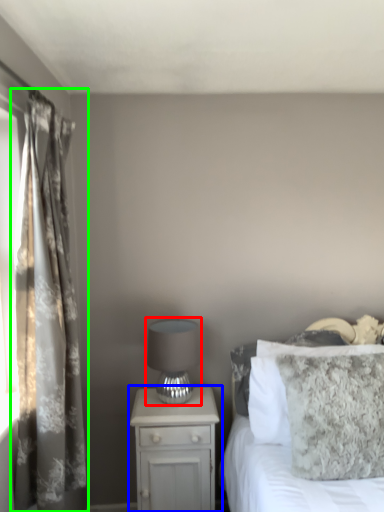
Question: Which object is positioned farthest from table lamp (highlighted by a red box)? Select from nightstand (highlighted by a blue box) and curtain (highlighted by a green box).

Choices:
 (A) nightstand
 (B) curtain

Answer: (B)